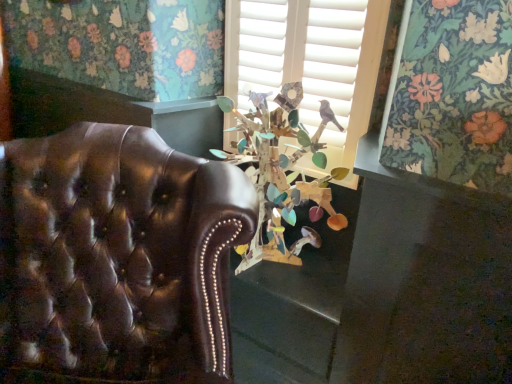
Question: From a real-world perspective, is wooden birdhouse at center physically located above or below shiny brown leather chair at left?

Choices:
 (A) above
 (B) below

Answer: (A)

Question: Is wooden birdhouse at center inside or outside of shiny brown leather chair at left?

Choices:
 (A) outside
 (B) inside

Answer: (A)

Question: Based on their relative distances, which object is nearer to the wooden birdhouse at center?

Choices:
 (A) wooden birdhouse at center
 (B) shiny brown leather chair at left

Answer: (A)

Question: Considering the real-world distances, which object is farthest from the wooden birdhouse at center?

Choices:
 (A) wooden birdhouse at center
 (B) shiny brown leather chair at left

Answer: (B)